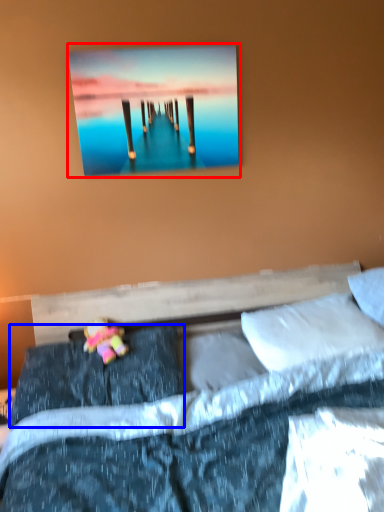
Question: Which object is closer to the camera taking this photo, picture frame (highlighted by a red box) or pillow (highlighted by a blue box)?

Choices:
 (A) picture frame
 (B) pillow

Answer: (B)